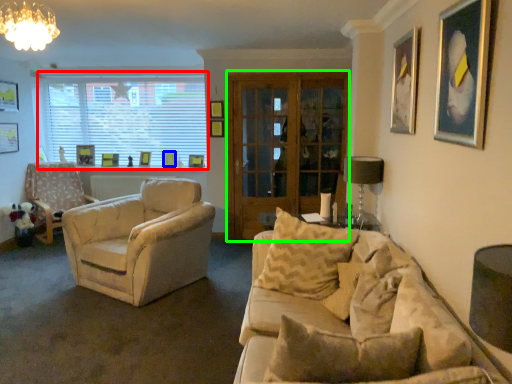
Question: Which object is positioned closest to window (highlighted by a red box)? Select from picture frame (highlighted by a blue box) and glass door (highlighted by a green box).

Choices:
 (A) picture frame
 (B) glass door

Answer: (A)